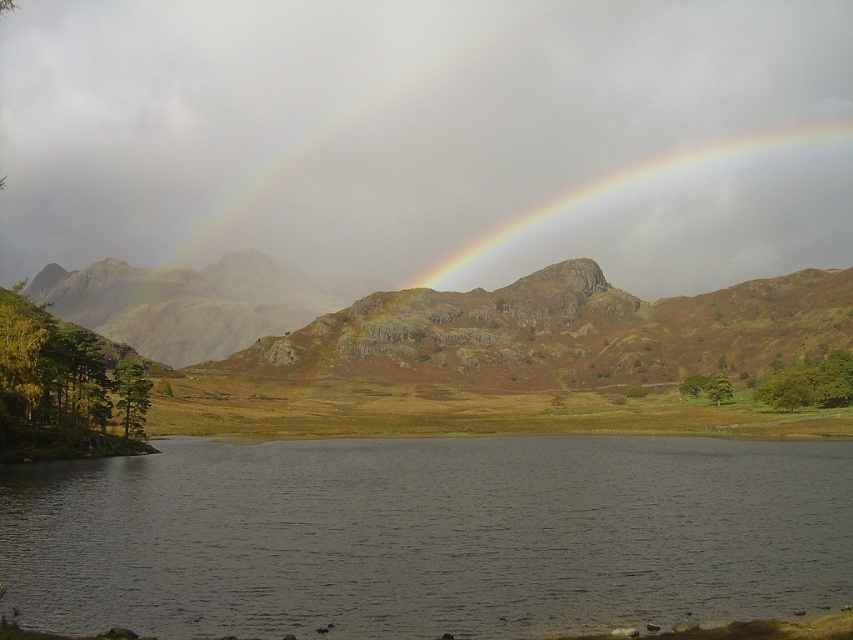
Is dark water at lower center further to camera compared to rustic stone mountain at center?

That is False.

Does dark water at lower center appear on the left side of rustic stone mountain at center?

No, dark water at lower center is not to the left of rustic stone mountain at center.

What do you see at coordinates (427, 536) in the screenshot? I see `dark water at lower center` at bounding box center [427, 536].

Locate an element on the screen. Image resolution: width=853 pixels, height=640 pixels. dark water at lower center is located at coordinates (427, 536).

Is dark water at lower center thinner than rainbow at upper center?

Correct, dark water at lower center's width is less than rainbow at upper center's.

Is dark water at lower center in front of rainbow at upper center?

Yes, it is.

Identify the location of dark water at lower center. Image resolution: width=853 pixels, height=640 pixels. (427, 536).

Does rainbow at upper center appear on the right side of rustic stone mountain at center?

Indeed, rainbow at upper center is positioned on the right side of rustic stone mountain at center.

In the scene shown: Measure the distance between point (285, 336) and camera.

Point (285, 336) is 308.37 meters away from camera.

Which is behind, point (517, 332) or point (289, 365)?

The point (517, 332) is more distant.

You are a GUI agent. You are given a task and a screenshot of the screen. Output one action in this format:
    pyautogui.click(x=<x>, y=<y>)
    Task: Click on the rainbow at upper center
    The width and height of the screenshot is (853, 640).
    Given the screenshot: What is the action you would take?
    pyautogui.click(x=563, y=330)